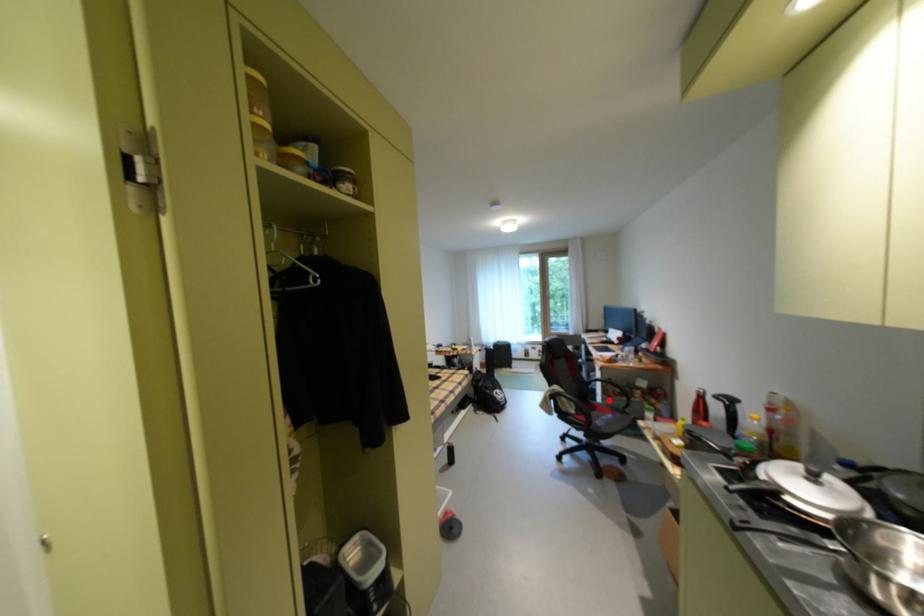
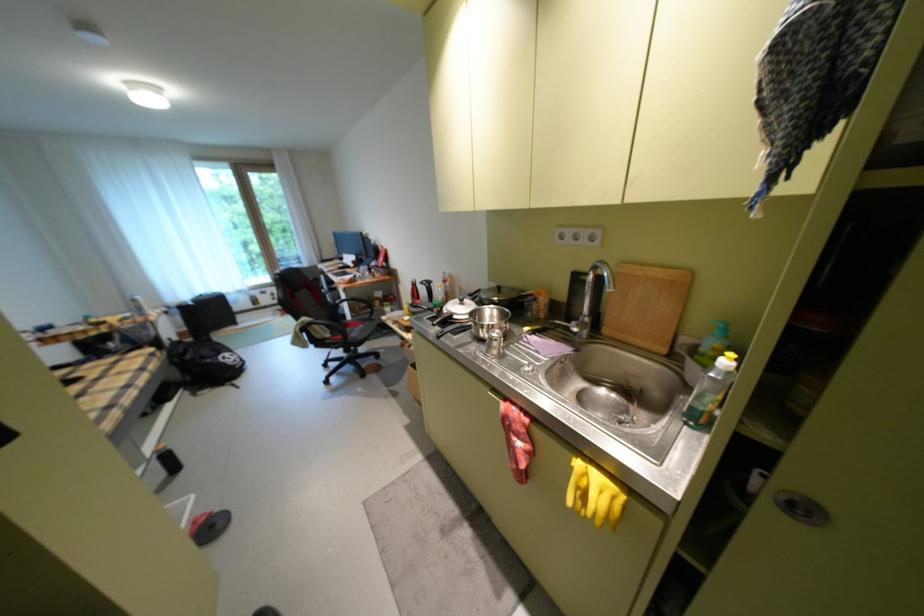
In the second image, find the point that corresponds to the highlighted location in the first image.

(359, 318)